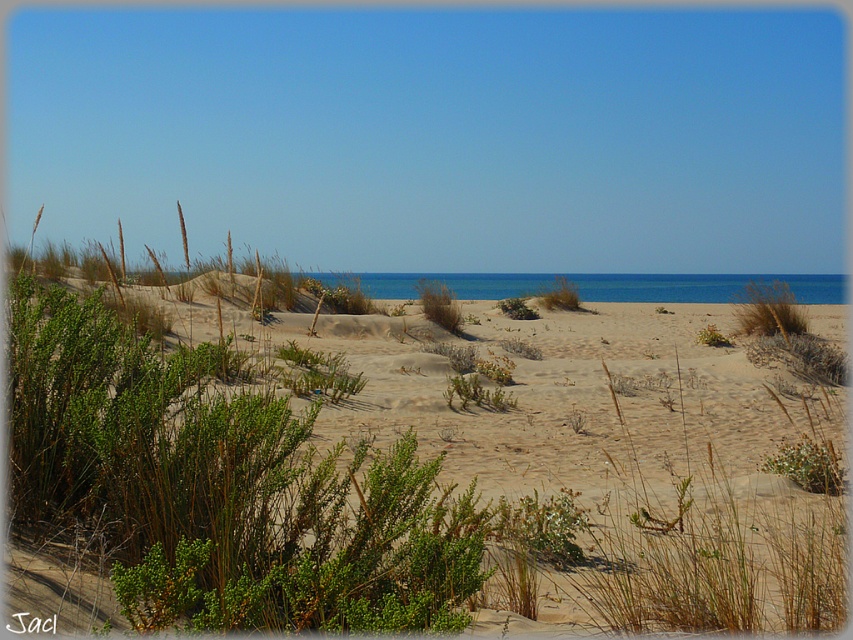
Is green shrubs at center to the right of green leafy bush at center from the viewer's perspective?

Incorrect, green shrubs at center is not on the right side of green leafy bush at center.

Between point (140, 358) and point (416, 285), which one is positioned in front?

Point (140, 358) is more forward.

Does point (805, 552) come behind point (424, 316)?

No, (805, 552) is closer to viewer.

Locate an element on the screen. green shrubs at center is located at coordinates (396, 499).

Can you confirm if green grass at center is shorter than green leafy bush at center?

No.

Which is in front, point (790, 310) or point (444, 324)?

Positioned in front is point (790, 310).

This screenshot has width=853, height=640. What are the coordinates of `green grass at center` in the screenshot? It's located at (767, 308).

At what (x,y) coordinates should I click in order to perform the action: click on green grass at center. Please return your answer as a coordinate pair (x, y). The height and width of the screenshot is (640, 853). Looking at the image, I should click on (767, 308).

Can you confirm if green shrubs at center is bigger than green grass at center?

Yes.

Describe the element at coordinates (396, 499) in the screenshot. I see `green shrubs at center` at that location.

This screenshot has height=640, width=853. What do you see at coordinates (396, 499) in the screenshot?
I see `green shrubs at center` at bounding box center [396, 499].

At what (x,y) coordinates should I click in order to perform the action: click on green shrubs at center. Please return your answer as a coordinate pair (x, y). Image resolution: width=853 pixels, height=640 pixels. Looking at the image, I should click on (396, 499).